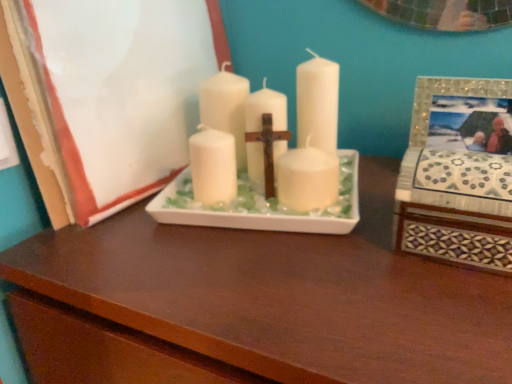
Question: Can you confirm if mosaic tile picture frame at right, placed as the first picture frame when sorted from right to left, is positioned to the right of white matte candle at center?

Choices:
 (A) no
 (B) yes

Answer: (B)

Question: Are mosaic tile picture frame at right, which is the second picture frame from left to right, and white matte candle at center beside each other?

Choices:
 (A) no
 (B) yes

Answer: (A)

Question: Considering the relative sizes of mosaic tile picture frame at right, which is the second picture frame from left to right, and white matte candle at center in the image provided, is mosaic tile picture frame at right, which is the second picture frame from left to right, wider than white matte candle at center?

Choices:
 (A) yes
 (B) no

Answer: (B)

Question: Does mosaic tile picture frame at right, which is the second picture frame from left to right, have a smaller size compared to white matte candle at center?

Choices:
 (A) yes
 (B) no

Answer: (A)

Question: Is mosaic tile picture frame at right, which is the second picture frame from left to right, taller than white matte candle at center?

Choices:
 (A) yes
 (B) no

Answer: (B)

Question: Does mosaic tile picture frame at right, which is the second picture frame from left to right, have a lesser height compared to white matte candle at center?

Choices:
 (A) yes
 (B) no

Answer: (A)

Question: Is matte white tray at center placed right next to white matte candle at center?

Choices:
 (A) no
 (B) yes

Answer: (A)

Question: Is matte white tray at center wider than white matte candle at center?

Choices:
 (A) no
 (B) yes

Answer: (B)

Question: Is matte white tray at center to the left of white matte candle at center from the viewer's perspective?

Choices:
 (A) no
 (B) yes

Answer: (A)

Question: From the image's perspective, is matte white tray at center located above white matte candle at center?

Choices:
 (A) yes
 (B) no

Answer: (B)

Question: Is matte white tray at center looking in the opposite direction of white matte candle at center?

Choices:
 (A) yes
 (B) no

Answer: (B)

Question: Can you confirm if matte white tray at center is thinner than white matte candle at center?

Choices:
 (A) yes
 (B) no

Answer: (B)

Question: Is matte white picture frame at center, the 1th picture frame in the left-to-right sequence, facing towards white matte candle at center?

Choices:
 (A) no
 (B) yes

Answer: (B)